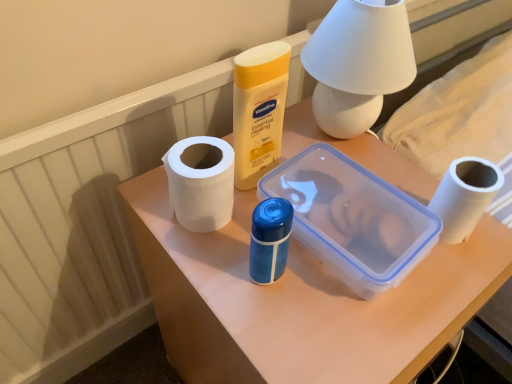
This screenshot has width=512, height=384. I want to click on empty space that is ontop of white matte plastic container at center (from a real-world perspective), so click(x=343, y=226).